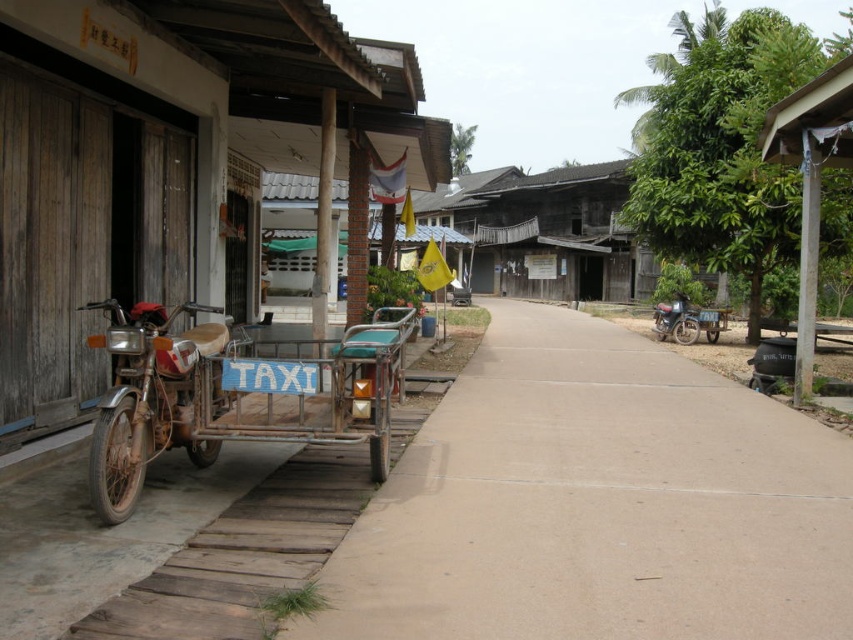
Question: Which object appears closest to the camera in this image?

Choices:
 (A) rusty metal motorcycle at left
 (B) wooden hut at right
 (C) rusty metal wagon at left
 (D) rusty metal tricycle at left

Answer: (A)

Question: Which point is closer to the camera taking this photo?

Choices:
 (A) (770, 157)
 (B) (33, 342)
 (C) (320, 346)
 (D) (170, 337)

Answer: (D)

Question: Observing the image, what is the correct spatial positioning of rusty metal wagon at left in reference to wooden hut at right?

Choices:
 (A) right
 (B) left

Answer: (B)

Question: Among these objects, which one is farthest from the camera?

Choices:
 (A) wooden hut at right
 (B) metallic blue motorcycle at right
 (C) rusty metal tricycle at left

Answer: (B)

Question: Is rusty metal wagon at left bigger than metallic blue motorcycle at right?

Choices:
 (A) yes
 (B) no

Answer: (B)

Question: Can you confirm if rusty metal wagon at left is smaller than wooden hut at right?

Choices:
 (A) yes
 (B) no

Answer: (A)